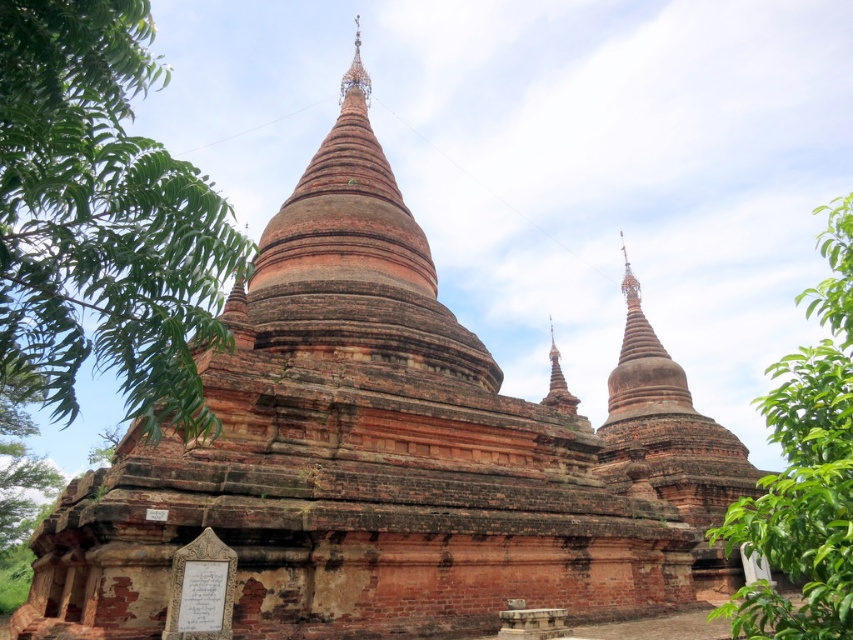
Does green leafy tree at left appear under gold metallic spire at upper center?

Yes, green leafy tree at left is below gold metallic spire at upper center.

This screenshot has width=853, height=640. What do you see at coordinates (102, 220) in the screenshot?
I see `green leafy tree at left` at bounding box center [102, 220].

The width and height of the screenshot is (853, 640). What are the coordinates of `green leafy tree at left` in the screenshot? It's located at (102, 220).

Consider the image. Between green leafy tree at left and smooth reddish-brown stupa at center-right, which one is positioned lower?

smooth reddish-brown stupa at center-right is lower down.

Where is `green leafy tree at left`? Image resolution: width=853 pixels, height=640 pixels. green leafy tree at left is located at coordinates (102, 220).

Between smooth reddish-brown stupa at center-right and gold metallic spire at upper center, which one has less height?

Standing shorter between the two is smooth reddish-brown stupa at center-right.

Who is lower down, smooth reddish-brown stupa at center-right or gold metallic spire at upper center?

smooth reddish-brown stupa at center-right is lower down.

You are a GUI agent. You are given a task and a screenshot of the screen. Output one action in this format:
    pyautogui.click(x=<x>, y=<y>)
    Task: Click on the smooth reddish-brown stupa at center-right
    
    Given the screenshot: What is the action you would take?
    pyautogui.click(x=556, y=381)